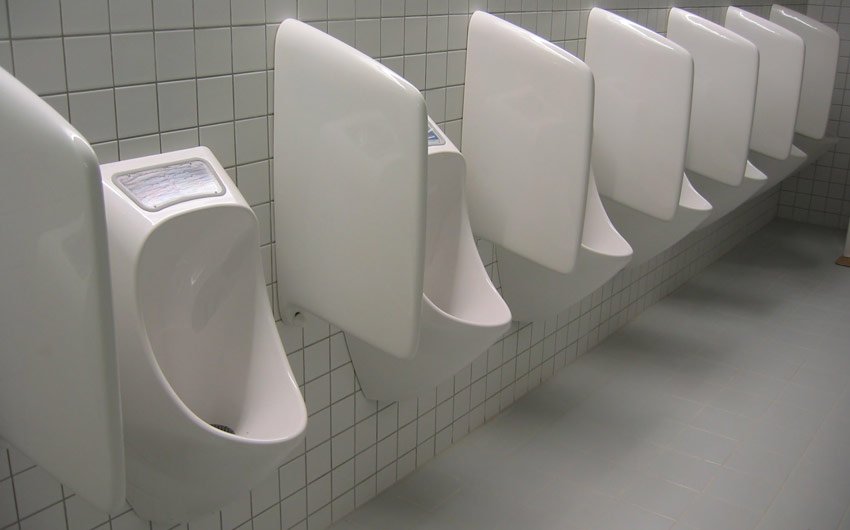
Identify the location of urinal dividers. (48, 349), (348, 195), (524, 134), (663, 107), (722, 91), (774, 84), (822, 73).